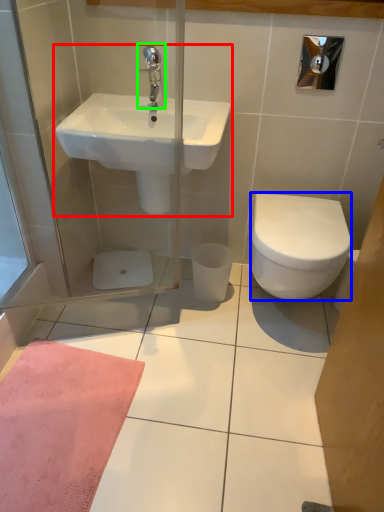
Question: Based on their relative distances, which object is farther from sink (highlighted by a red box)? Choose from bidet (highlighted by a blue box) and tap (highlighted by a green box).

Choices:
 (A) bidet
 (B) tap

Answer: (A)